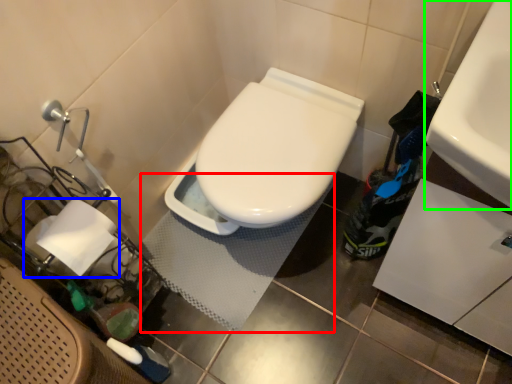
Question: Considering the real-world distances, which object is farthest from bath mat (highlighted by a red box)? toilet paper (highlighted by a blue box) or sink (highlighted by a green box)?

Choices:
 (A) toilet paper
 (B) sink

Answer: (B)